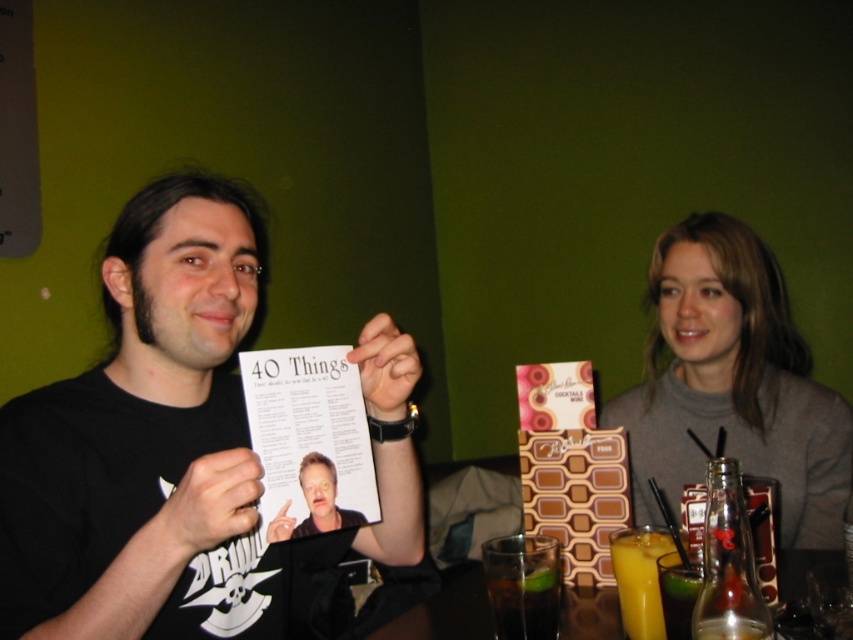
Is clear glass bottle at lower right taller than translucent glass juice at lower right?

Indeed, clear glass bottle at lower right has a greater height compared to translucent glass juice at lower right.

Which is above, clear glass bottle at lower right or translucent glass juice at lower right?

clear glass bottle at lower right is higher up.

Is point (730, 573) less distant than point (621, 576)?

Yes, point (730, 573) is in front of point (621, 576).

In order to click on clear glass bottle at lower right in this screenshot , I will do click(728, 563).

Does black matte paper at center appear on the left side of translucent glass table at lower center?

Correct, you'll find black matte paper at center to the left of translucent glass table at lower center.

Can you confirm if black matte paper at center is wider than translucent glass table at lower center?

In fact, black matte paper at center might be narrower than translucent glass table at lower center.

Is point (64, 557) farther from viewer compared to point (791, 563)?

That is False.

Find the location of `black matte paper at center`. black matte paper at center is located at coordinates (178, 444).

Can you confirm if translucent glass juice at lower right is smaller than translucent glass at lower right?

Answer: No.

Can you confirm if translucent glass juice at lower right is positioned below translucent glass at lower right?

Actually, translucent glass juice at lower right is above translucent glass at lower right.

Is point (634, 611) closer to camera compared to point (698, 577)?

No, it is not.

The height and width of the screenshot is (640, 853). In order to click on translucent glass juice at lower right in this screenshot , I will do `click(640, 579)`.